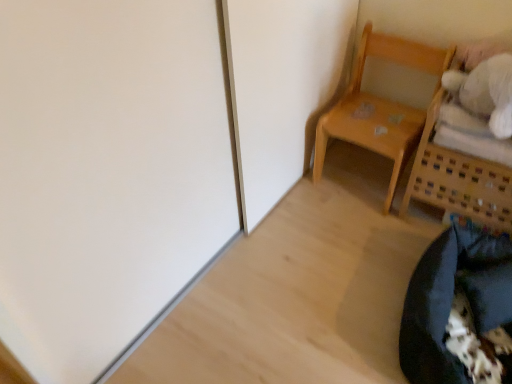
The width and height of the screenshot is (512, 384). Identify the location of free spot in front of light wood chair at upper right, which is the second furniture in right-to-left order. (360, 229).